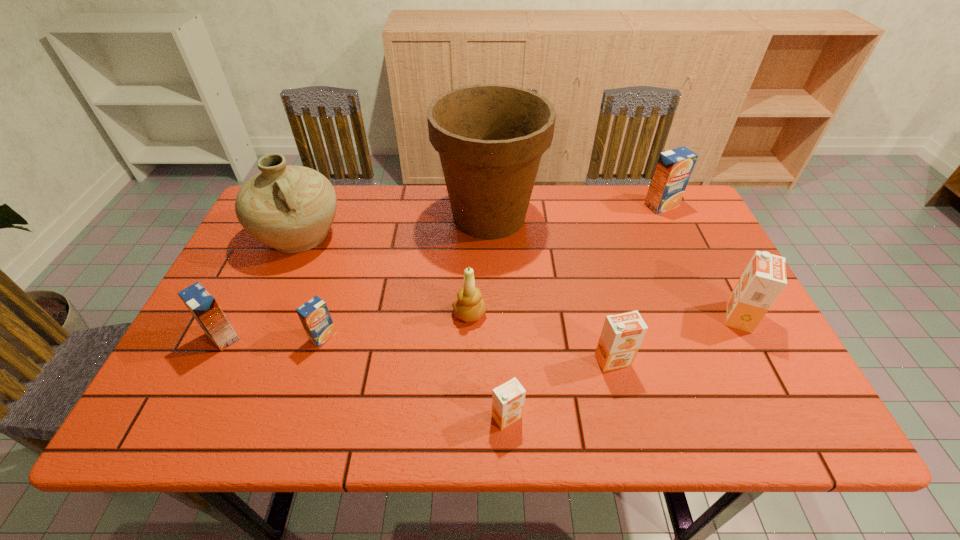
Where is `object positioned at the far left corner`? The height and width of the screenshot is (540, 960). object positioned at the far left corner is located at coordinates (290, 208).

Identify the location of object that is at the far right corner. The width and height of the screenshot is (960, 540). (674, 167).

This screenshot has height=540, width=960. Identify the location of free region at the far edge of the desktop. (612, 204).

What are the coordinates of `vacant space at the near edge of the desktop` in the screenshot? It's located at (560, 404).

Find the location of `free space at the left edge of the desktop`. free space at the left edge of the desktop is located at coordinates (237, 360).

Locate an element on the screen. This screenshot has width=960, height=540. free region at the right edge of the desktop is located at coordinates (741, 377).

What are the coordinates of `vacant space at the near left corner of the desktop` in the screenshot? It's located at (175, 418).

In the image, there is a desktop. Where is `vacant space at the near right corner`? Image resolution: width=960 pixels, height=540 pixels. vacant space at the near right corner is located at coordinates 811,423.

Identify the location of free space between the smallest blue orange_juice and the farthest blue orange_juice. [492, 271].

Where is `blank region between the farthest orange juice and the leftmost orange juice`? The height and width of the screenshot is (540, 960). blank region between the farthest orange juice and the leftmost orange juice is located at coordinates (443, 271).